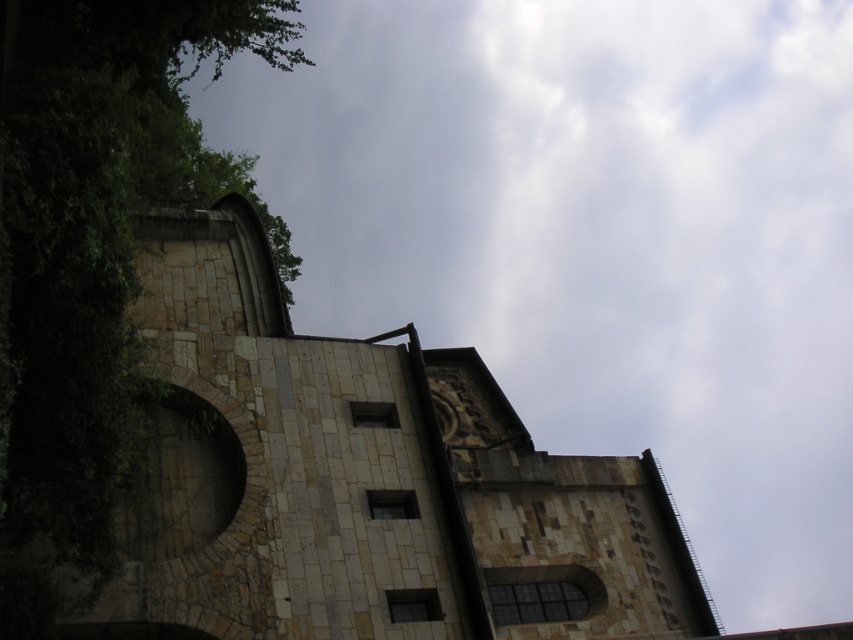
Question: Which of the following is the farthest from the observer?

Choices:
 (A) green leafy tree at upper left
 (B) stone church at center

Answer: (B)

Question: Is stone church at center thinner than green leafy tree at upper left?

Choices:
 (A) no
 (B) yes

Answer: (B)

Question: Considering the relative positions of stone church at center and green leafy tree at upper left in the image provided, where is stone church at center located with respect to green leafy tree at upper left?

Choices:
 (A) right
 (B) left

Answer: (A)

Question: Which object is closer to the camera taking this photo?

Choices:
 (A) stone church at center
 (B) green leafy tree at upper left

Answer: (B)

Question: Which point appears closest to the camera in this image?

Choices:
 (A) (85, 97)
 (B) (345, 476)

Answer: (A)

Question: Can you confirm if stone church at center is positioned above green leafy tree at upper left?

Choices:
 (A) no
 (B) yes

Answer: (A)